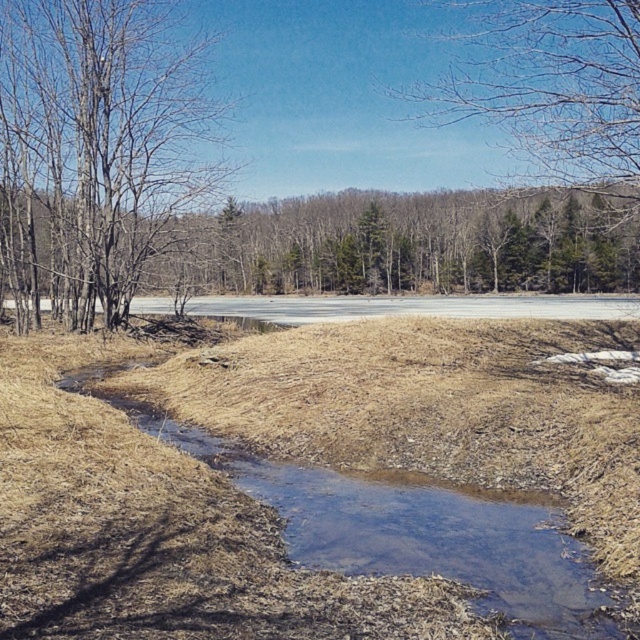
Is clear water at center thinner than brown leafless tree at upper center?

Yes, clear water at center is thinner than brown leafless tree at upper center.

Does clear water at center have a lesser height compared to brown leafless tree at upper center?

Correct, clear water at center is not as tall as brown leafless tree at upper center.

I want to click on clear water at center, so pos(419,532).

Is bare branches at left shorter than clear water at center?

No, bare branches at left is not shorter than clear water at center.

Can you confirm if bare branches at left is bigger than clear water at center?

Yes.

You are a GUI agent. You are given a task and a screenshot of the screen. Output one action in this format:
    pyautogui.click(x=<x>, y=<y>)
    Task: Click on the bare branches at left
    The image size is (640, 640).
    Given the screenshot: What is the action you would take?
    pyautogui.click(x=97, y=147)

Who is more distant from viewer, (132, 209) or (438, 83)?

The point (438, 83) is behind.

Locate an element on the screen. The image size is (640, 640). bare branches at left is located at coordinates pos(97,147).

Does point (97, 161) come in front of point (568, 90)?

No, it is behind (568, 90).

At what (x,y) coordinates should I click in order to perform the action: click on bare branches at left. Please return your answer as a coordinate pair (x, y). Looking at the image, I should click on (97, 147).